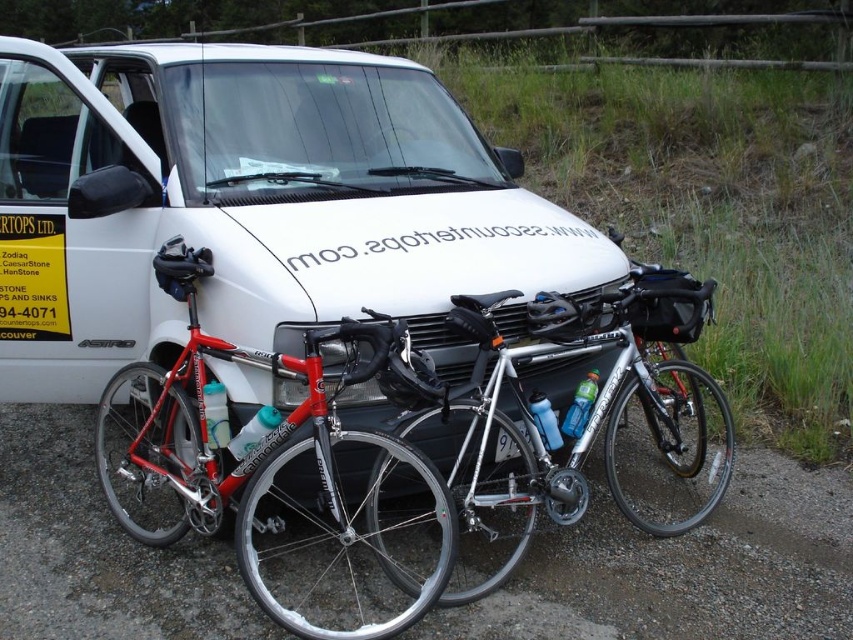
You are standing in front of the white van and need to determine the relative positions of two points marked on the van. Which point is closer to you, point (393, 74) or point (610, 456)?

Point (393, 74) is closer to you because it is further to the viewer than point (610, 456).

You are planning to carry both the shiny red bike at center and the silver metallic bicycle at center into a storage room. The storage room has a width of 1.5 meters. Can both bikes fit side by side without overlapping?

The shiny red bike at center is smaller than the silver metallic bicycle at center. However, since the exact dimensions of each bike are not provided, it is uncertain whether their combined width would exceed the 1.5 meters available. Further measurements are needed to determine if they can fit side by side without overlapping.

You are a cyclist who wants to retrieve your gear from the shiny red bike at center and the silver metallic bicycle at center. Since both bikes are leaning against the van, which bike should you move first to access the gear on the other one?

You should move the shiny red bike at center first because it is in front of the silver metallic bicycle at center, so moving it will allow you to access the gear on the silver metallic bicycle at center.